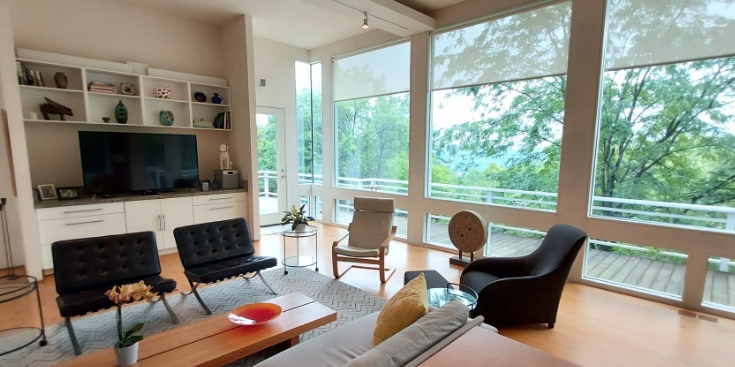
Where is `inside someones home`? inside someones home is located at coordinates (294, 231).